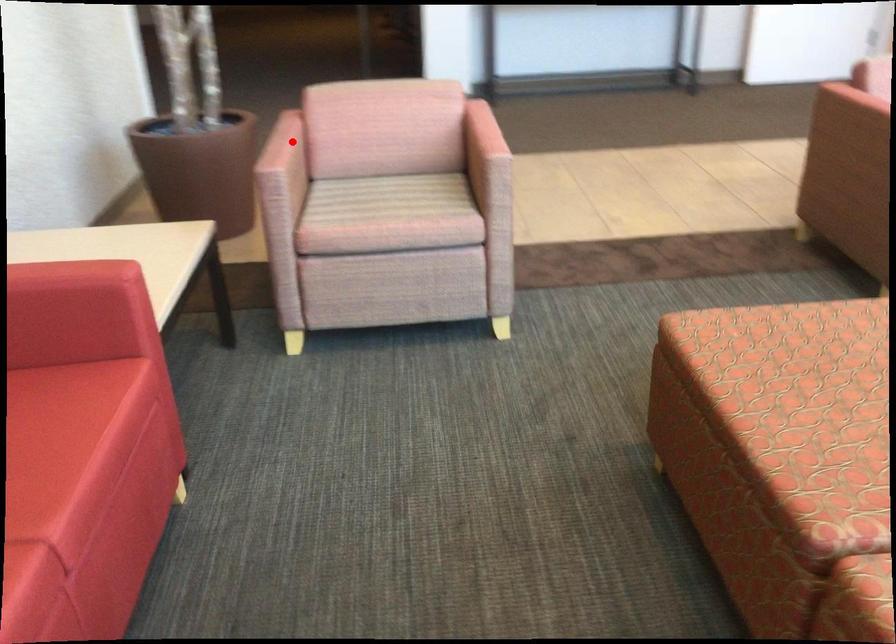
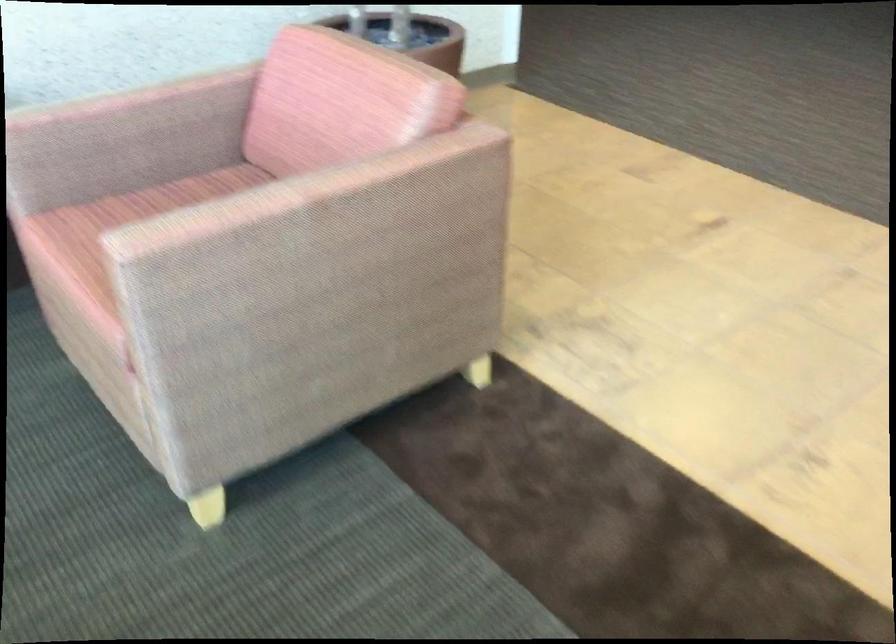
Find the pixel in the second image that matches the highlighted location in the first image.

(121, 98)